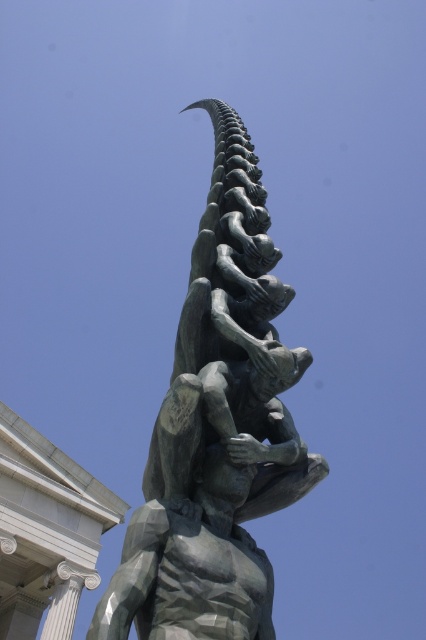
You are an art student analyzing the sculpture. You notice two parts labeled as the bronze textured sculpture at center and the polished bronze statue at center. Which part is bigger?

The bronze textured sculpture at center is larger in size than the polished bronze statue at center.

You are an art student standing in front of the sculpture. You notice two parts of the sculpture labeled as the bronze textured sculpture at center and the polished bronze statue at center. Which part is closer to you?

The bronze textured sculpture at center is closer to you because it is further to the viewer than the polished bronze statue at center.